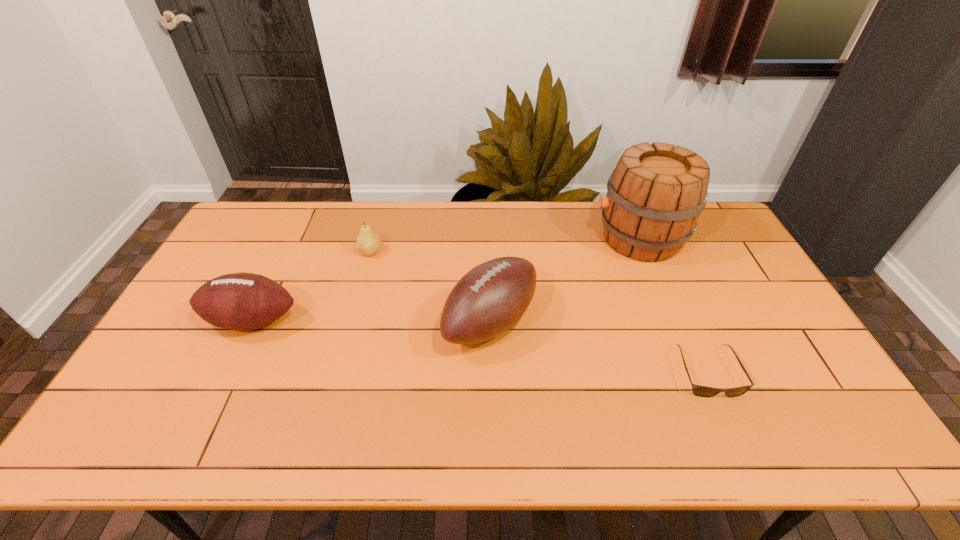
Locate an element on the screen. cider is located at coordinates 655,195.

The height and width of the screenshot is (540, 960). Find the location of `the third object from right to left`. the third object from right to left is located at coordinates (488, 300).

This screenshot has width=960, height=540. In order to click on the taller football (American) in this screenshot , I will do `click(488, 300)`.

Find the location of a particular element. The height and width of the screenshot is (540, 960). the third tallest object is located at coordinates (242, 301).

Locate an element on the screen. the shorter football (American) is located at coordinates (242, 301).

Find the location of a particular element. The image size is (960, 540). the fourth object from right to left is located at coordinates (368, 242).

Where is `pear`? The width and height of the screenshot is (960, 540). pear is located at coordinates (368, 242).

This screenshot has height=540, width=960. I want to click on the shortest object, so click(x=701, y=391).

Identify the location of free space located 0.340m on the side of the tallest object where the spigot is located. The image size is (960, 540). (494, 238).

I want to click on free space located on the side of the tallest object where the spigot is located, so 506,238.